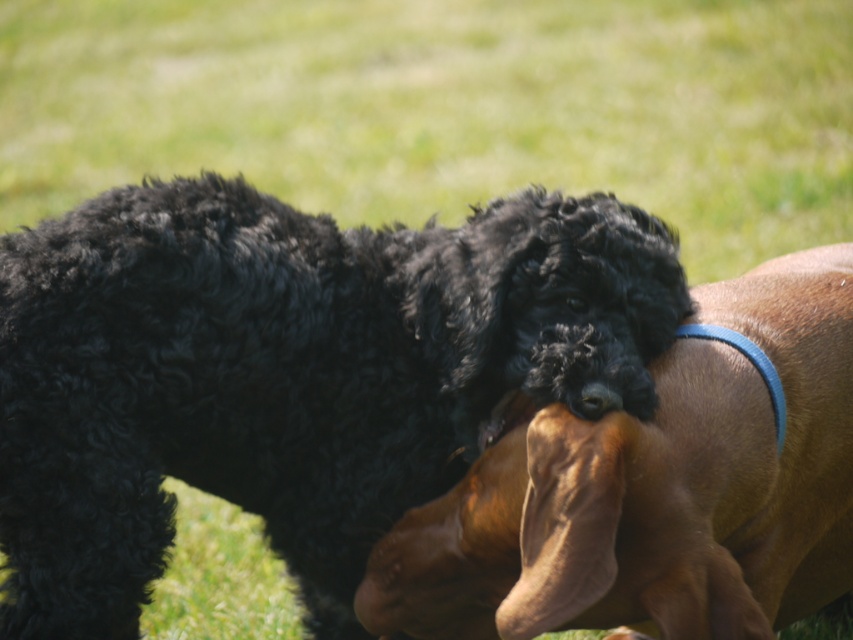
You are a photographer standing at the origin point of the image coordinate system. You want to take a photo of the black curly fur dog at center. What are the coordinates of the dog?

The coordinates of the black curly fur dog at center are at point (288,374).

Based on the photo, you are a photographer trying to capture both the black curly fur dog at center and the black curly fur at center in a single shot. Based on their positions, which one is closer to the camera?

The black curly fur dog at center is closer to the camera because it is positioned above the black curly fur at center, indicating it is in front of the other object.

You are a dog owner who wants to buy a new collar for both dogs in the image. The black curly fur dog at center and the black curly fur at center. Which dog requires a smaller collar?

The black curly fur dog at center is smaller than the black curly fur at center, so the black curly fur dog at center requires a smaller collar.